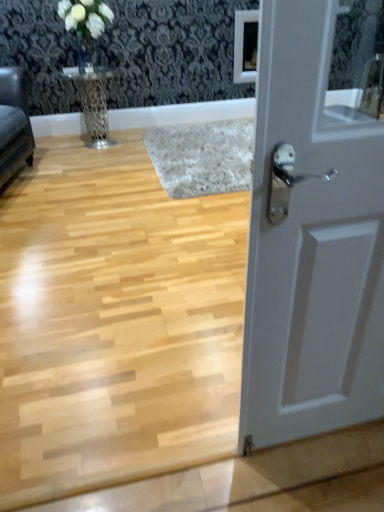
What do you see at coordinates (93, 103) in the screenshot? Image resolution: width=384 pixels, height=512 pixels. I see `metallic silver table at upper left` at bounding box center [93, 103].

The image size is (384, 512). What do you see at coordinates (14, 123) in the screenshot? I see `velvet dark gray sofa at left` at bounding box center [14, 123].

The height and width of the screenshot is (512, 384). I want to click on metallic silver table at upper left, so click(93, 103).

Considering the sizes of objects metallic silver table at upper left and white matte door at right in the image provided, who is wider, metallic silver table at upper left or white matte door at right?

metallic silver table at upper left.

Which is closer to the camera, (99, 145) or (264, 176)?

The point (264, 176) is closer to the camera.

From the picture: From the image's perspective, which one is positioned lower, metallic silver table at upper left or white matte door at right?

white matte door at right appears lower in the image.

Is point (16, 68) in front of point (104, 123)?

Yes, it is in front of point (104, 123).

Who is shorter, velvet dark gray sofa at left or metallic silver table at upper left?

With less height is metallic silver table at upper left.

From the image's perspective, which one is positioned lower, velvet dark gray sofa at left or metallic silver table at upper left?

velvet dark gray sofa at left, from the image's perspective.

In the scene shown: Could you tell me if velvet dark gray sofa at left is facing metallic silver table at upper left?

Result: No, velvet dark gray sofa at left is not turned towards metallic silver table at upper left.

From the image's perspective, relative to metallic silver table at upper left, is white matte door at right above or below?

From the image's perspective, white matte door at right appears below metallic silver table at upper left.

Based on the photo, is metallic silver table at upper left surrounded by white matte door at right?

No, white matte door at right does not contain metallic silver table at upper left.

What's the angular difference between white matte door at right and metallic silver table at upper left's facing directions?

There is a 180-degree angle between the facing directions of white matte door at right and metallic silver table at upper left.

Considering the relative sizes of white matte door at right and metallic silver table at upper left in the image provided, is white matte door at right taller than metallic silver table at upper left?

Yes, white matte door at right is taller than metallic silver table at upper left.

From a real-world perspective, which object rests below the other?

white matte door at right, from a real-world perspective.

Is clear glass vase at upper left oriented towards white matte door at right?

Yes, clear glass vase at upper left is aimed at white matte door at right.

What's the angular difference between clear glass vase at upper left and white matte door at right's facing directions?

The angular difference between clear glass vase at upper left and white matte door at right is 178 degrees.

Is clear glass vase at upper left in front of or behind white matte door at right in the image?

clear glass vase at upper left is behind white matte door at right.

Which of these two, velvet dark gray sofa at left or white matte door at right, is wider?

velvet dark gray sofa at left.

How many degrees apart are the facing directions of velvet dark gray sofa at left and white matte door at right?

103 degrees.

Would you consider velvet dark gray sofa at left to be distant from white matte door at right?

Yes, velvet dark gray sofa at left is far from white matte door at right.

Does velvet dark gray sofa at left have a smaller size compared to white matte door at right?

No, velvet dark gray sofa at left is not smaller than white matte door at right.

Is metallic silver table at upper left in contact with clear glass vase at upper left?

No.

Can you confirm if metallic silver table at upper left is bigger than clear glass vase at upper left?

Yes.

Would you say metallic silver table at upper left is to the left or to the right of clear glass vase at upper left in the picture?

In the image, metallic silver table at upper left appears on the left side of clear glass vase at upper left.

From the image's perspective, is metallic silver table at upper left above clear glass vase at upper left?

Incorrect, from the image's perspective, metallic silver table at upper left is lower than clear glass vase at upper left.

The width and height of the screenshot is (384, 512). What are the coordinates of `glass vase located above the velvet dark gray sofa at left (from the image's perspective)` in the screenshot? It's located at (85, 53).

From the image's perspective, which object appears higher, velvet dark gray sofa at left or clear glass vase at upper left?

clear glass vase at upper left appears higher in the image.

Which of these two, velvet dark gray sofa at left or clear glass vase at upper left, stands shorter?

clear glass vase at upper left.

Based on the photo, which object is positioned more to the left, velvet dark gray sofa at left or clear glass vase at upper left?

velvet dark gray sofa at left.

In the image, there is a white matte door at right. Where is `table above it (from the image's perspective)`? Image resolution: width=384 pixels, height=512 pixels. table above it (from the image's perspective) is located at coordinates (93, 103).

Where is `furniture above the metallic silver table at upper left (from a real-world perspective)`? This screenshot has width=384, height=512. furniture above the metallic silver table at upper left (from a real-world perspective) is located at coordinates (14, 123).

Estimate the real-world distances between objects in this image. Which object is closer to white matte door at right, metallic silver table at upper left or clear glass vase at upper left?

Among the two, metallic silver table at upper left is located nearer to white matte door at right.

From the image, which object appears to be nearer to metallic silver table at upper left, velvet dark gray sofa at left or white matte door at right?

velvet dark gray sofa at left.

Considering their positions, is metallic silver table at upper left positioned closer to velvet dark gray sofa at left than clear glass vase at upper left?

metallic silver table at upper left.

From the image, which object appears to be farther from velvet dark gray sofa at left, white matte door at right or metallic silver table at upper left?

white matte door at right lies further to velvet dark gray sofa at left than the other object.

Estimate the real-world distances between objects in this image. Which object is closer to white matte door at right, metallic silver table at upper left or velvet dark gray sofa at left?

Among the two, velvet dark gray sofa at left is located nearer to white matte door at right.

Which object lies nearer to the anchor point white matte door at right, clear glass vase at upper left or metallic silver table at upper left?

Based on the image, metallic silver table at upper left appears to be nearer to white matte door at right.

Which object lies further to the anchor point velvet dark gray sofa at left, white matte door at right or clear glass vase at upper left?

Based on the image, white matte door at right appears to be further to velvet dark gray sofa at left.

Which object lies nearer to the anchor point clear glass vase at upper left, white matte door at right or metallic silver table at upper left?

Among the two, metallic silver table at upper left is located nearer to clear glass vase at upper left.

At what (x,y) coordinates should I click in order to perform the action: click on glass vase between white matte door at right and metallic silver table at upper left from front to back. Please return your answer as a coordinate pair (x, y). This screenshot has width=384, height=512. Looking at the image, I should click on (85, 53).

The image size is (384, 512). I want to click on glass vase between velvet dark gray sofa at left and metallic silver table at upper left from front to back, so coord(85,53).

Locate an element on the screen. The height and width of the screenshot is (512, 384). furniture located between white matte door at right and clear glass vase at upper left in the depth direction is located at coordinates (14, 123).

The height and width of the screenshot is (512, 384). What are the coordinates of `furniture located between white matte door at right and metallic silver table at upper left in the depth direction` in the screenshot? It's located at (14, 123).